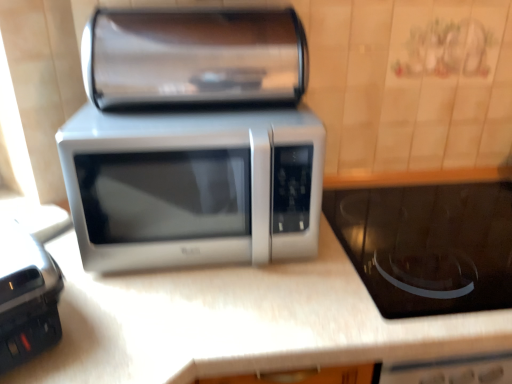
Question: Is white laminate counter at center taller or shorter than satin silver microwave at center?

Choices:
 (A) tall
 (B) short

Answer: (A)

Question: Is white laminate counter at center to the left or to the right of satin silver microwave at center in the image?

Choices:
 (A) right
 (B) left

Answer: (A)

Question: Which object is positioned closest to the black plastic toaster at lower left, which ranks as the 2th appliance in right-to-left order?

Choices:
 (A) satin silver microwave at center
 (B) satin silver microwave at center
 (C) white laminate counter at center
 (D) black glass cooktop at center, marked as the second appliance in a left-to-right arrangement

Answer: (C)

Question: Considering the real-world distances, which object is farthest from the black glass cooktop at center, which is the 1th appliance in right-to-left order?

Choices:
 (A) white laminate counter at center
 (B) satin silver microwave at center
 (C) black plastic toaster at lower left, which ranks as the 2th appliance in right-to-left order
 (D) satin silver microwave at center

Answer: (C)